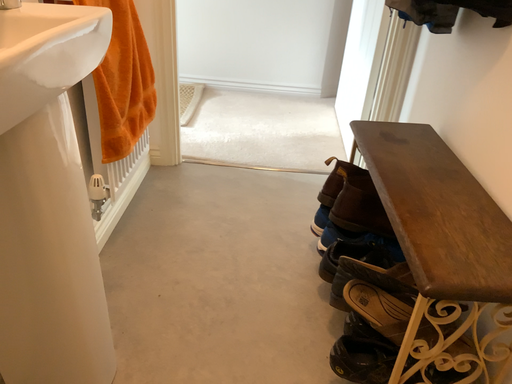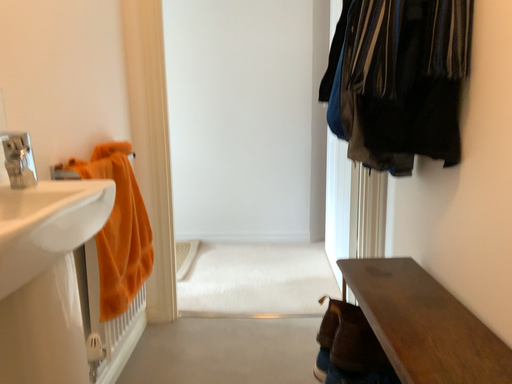
Question: How did the camera likely rotate when shooting the video?

Choices:
 (A) rotated upward
 (B) rotated downward

Answer: (A)